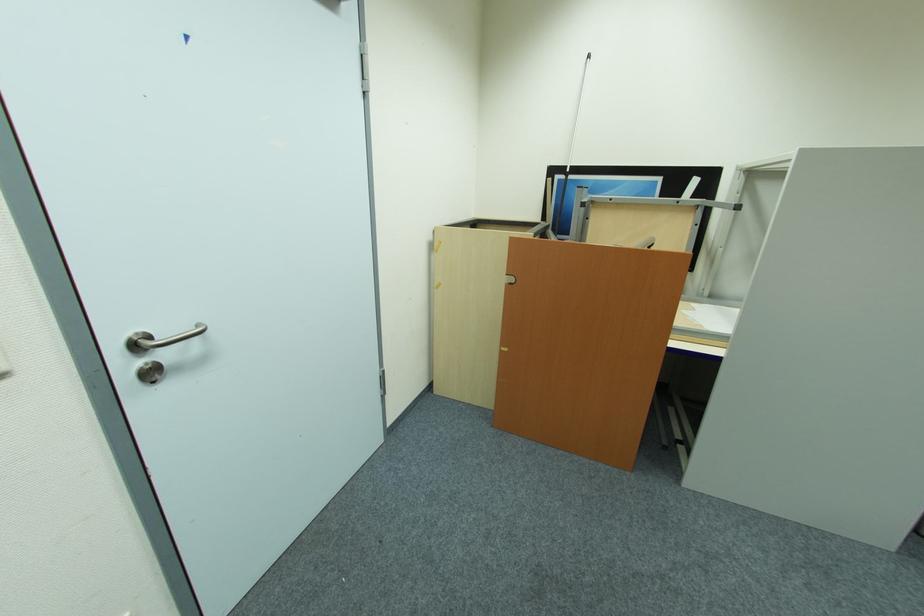
Find the location of a particular element. The width and height of the screenshot is (924, 616). metal door handle is located at coordinates (160, 339).